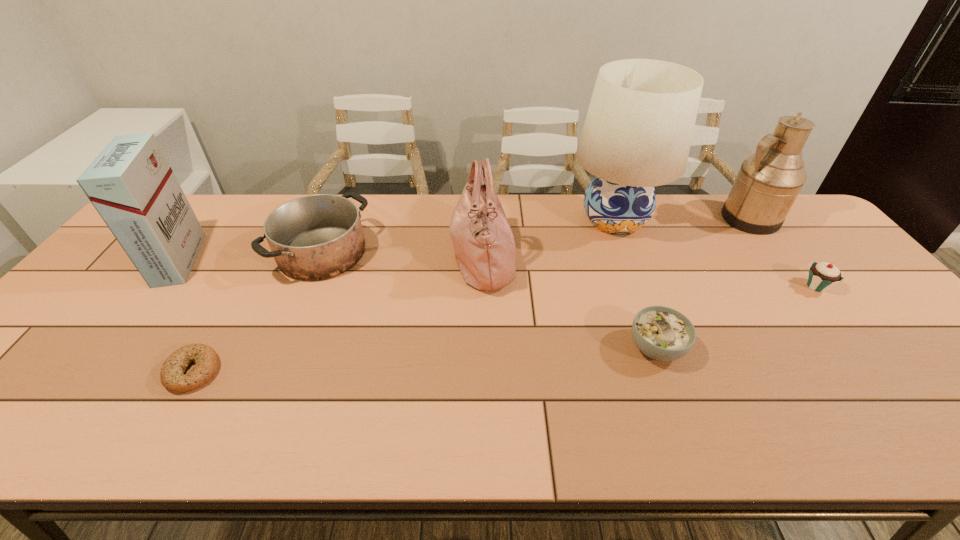
Where is `vacant region between the bagel and the leftmost object`? The image size is (960, 540). vacant region between the bagel and the leftmost object is located at coordinates (186, 316).

Locate which object ranks in proximity to the soup bowl. Please provide its 2D coordinates. Your answer should be formatted as a tuple, i.e. [(x, y)], where the tuple contains the x and y coordinates of a point satisfying the conditions above.

[(483, 242)]

The image size is (960, 540). Identify the location of object that is the sixth closest to the bagel. (768, 182).

At what (x,y) coordinates should I click in order to perform the action: click on vacant region that satisfies the following two spatial constraints: 1. at the front of the cupcake with handles; 2. on the left side of the handbag. Please return your answer as a coordinate pair (x, y). Image resolution: width=960 pixels, height=540 pixels. Looking at the image, I should click on (483, 286).

Locate an element on the screen. free spot that satisfies the following two spatial constraints: 1. on the back side of the fifth tallest object; 2. on the left side of the shortest object is located at coordinates (260, 253).

Locate an element on the screen. Image resolution: width=960 pixels, height=540 pixels. vacant position in the image that satisfies the following two spatial constraints: 1. on the back side of the cupcake; 2. on the left side of the bagel is located at coordinates (241, 286).